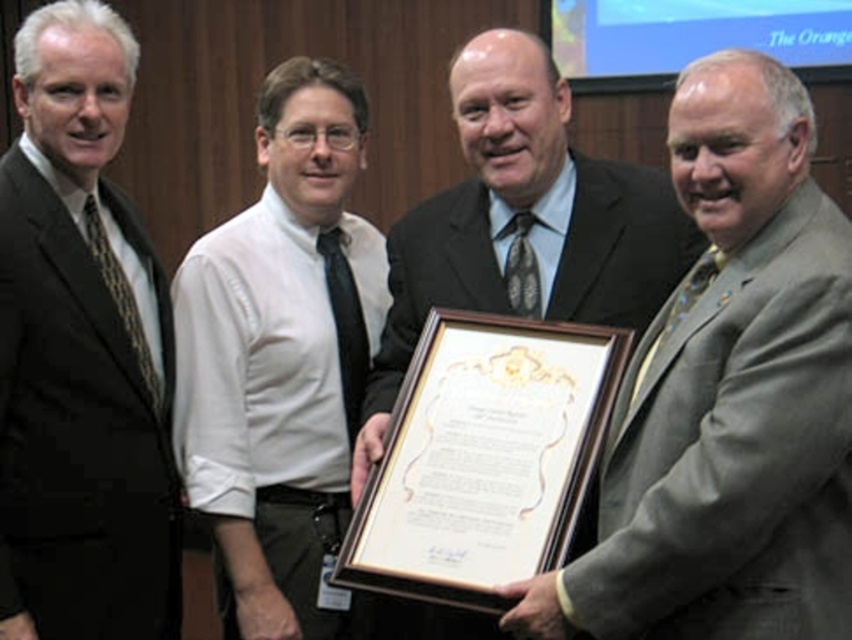
Question: Does gray wool suit at right lie behind matte black suit at left?

Choices:
 (A) no
 (B) yes

Answer: (A)

Question: Which point is farther to the camera?

Choices:
 (A) click(x=308, y=314)
 (B) click(x=53, y=122)

Answer: (A)

Question: Can you confirm if gray wool suit at right is positioned to the left of matte black suit at left?

Choices:
 (A) no
 (B) yes

Answer: (A)

Question: Which of these objects is positioned closest to the white shirt at center?

Choices:
 (A) matte black suit at center
 (B) matte black suit at left

Answer: (B)

Question: Does gray wool suit at right come behind matte black suit at left?

Choices:
 (A) no
 (B) yes

Answer: (A)

Question: Among these objects, which one is nearest to the camera?

Choices:
 (A) matte black suit at center
 (B) white shirt at center

Answer: (A)